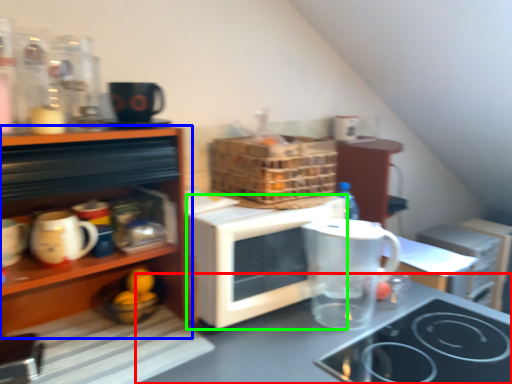
Question: Which object is positioned farthest from countertop (highlighted by a red box)? Select from cabinetry (highlighted by a blue box) and microwave oven (highlighted by a green box).

Choices:
 (A) cabinetry
 (B) microwave oven

Answer: (A)